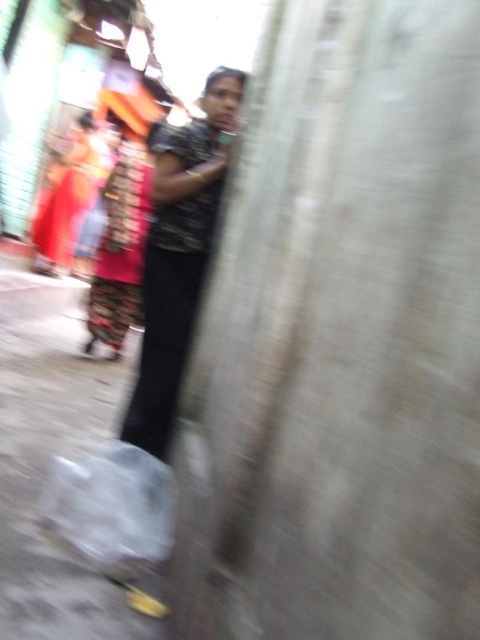
Question: Which of these objects is positioned farthest from the shiny red fabric dress at center?

Choices:
 (A) matte red saree at left
 (B) dark textured shirt at center

Answer: (A)

Question: Which point is farther to the camera?

Choices:
 (A) shiny red fabric dress at center
 (B) dark textured shirt at center

Answer: (A)

Question: Which point is closer to the camera taking this photo?

Choices:
 (A) (193, 244)
 (B) (69, 208)
 (C) (144, 172)

Answer: (A)

Question: Can you confirm if shiny red fabric dress at center is smaller than matte red saree at left?

Choices:
 (A) no
 (B) yes

Answer: (B)

Question: Can you confirm if shiny red fabric dress at center is positioned above matte red saree at left?

Choices:
 (A) no
 (B) yes

Answer: (A)

Question: Where is dark textured shirt at center located in relation to shiny red fabric dress at center in the image?

Choices:
 (A) above
 (B) below

Answer: (B)